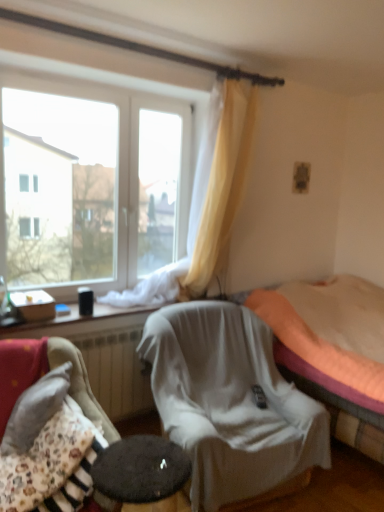
I want to click on free space to the left of black glossy coffee cup at lower left, so click(x=69, y=312).